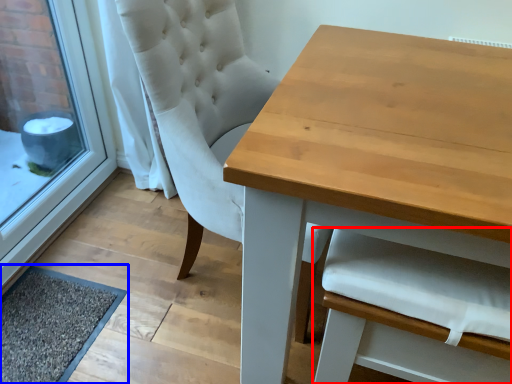
Question: Among these objects, which one is nearest to the camera, armchair (highlighted by a red box) or doormat (highlighted by a blue box)?

Choices:
 (A) armchair
 (B) doormat

Answer: (A)